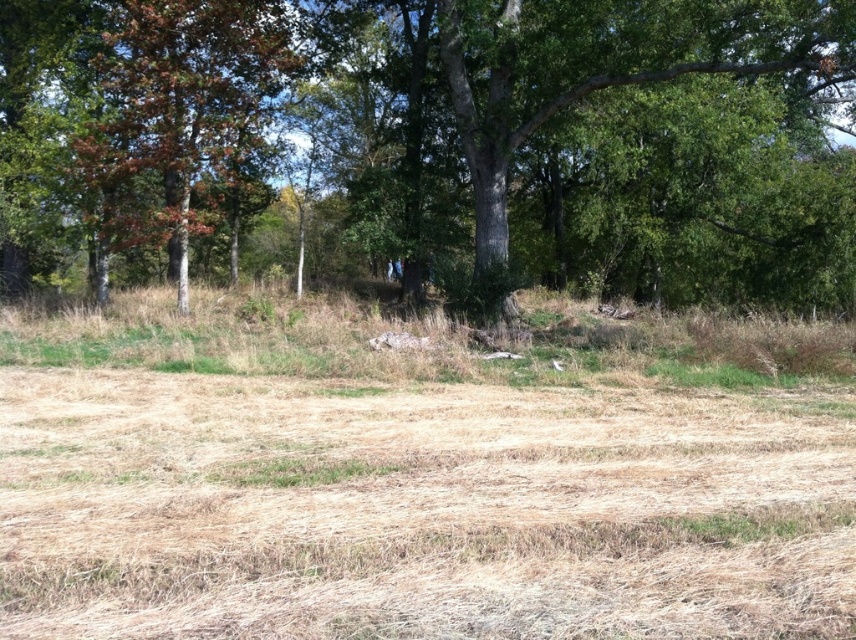
In the scene shown: Is green rough bark tree at upper center thinner than orange-brown bark tree at left?

No.

Is the position of green rough bark tree at upper center more distant than that of orange-brown bark tree at left?

No, it is not.

Image resolution: width=856 pixels, height=640 pixels. I want to click on green rough bark tree at upper center, so point(440,140).

The width and height of the screenshot is (856, 640). I want to click on green rough bark tree at upper center, so click(440, 140).